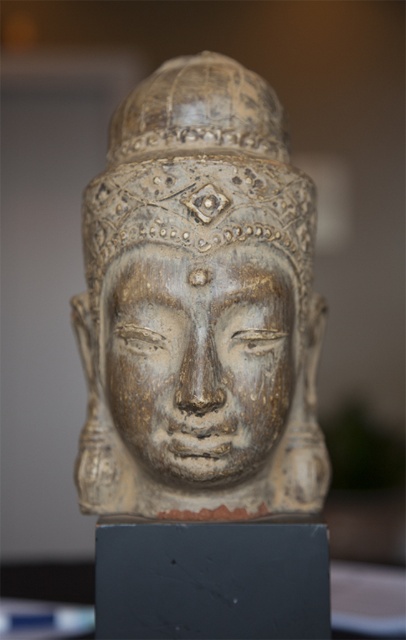
Describe the element at coordinates (200, 307) in the screenshot. I see `golden carved head at center` at that location.

Can you confirm if golden carved head at center is smaller than golden carved face at center?

Incorrect, golden carved head at center is not smaller in size than golden carved face at center.

The image size is (406, 640). What do you see at coordinates (200, 307) in the screenshot? I see `golden carved head at center` at bounding box center [200, 307].

Image resolution: width=406 pixels, height=640 pixels. Find the location of `golden carved head at center`. golden carved head at center is located at coordinates (200, 307).